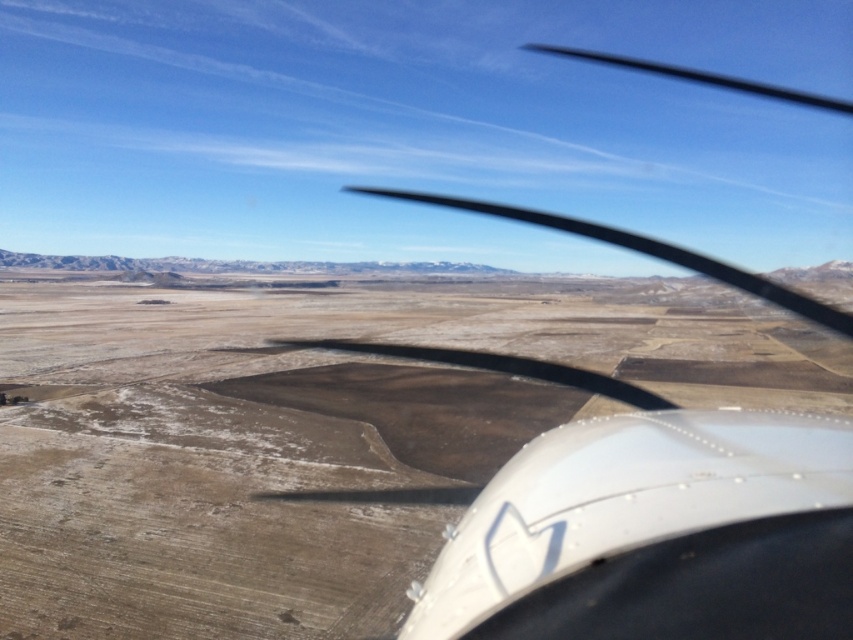
You are a passenger sitting in the aircraft and looking out the window. You notice two points marked on the window. The first is at point coordinates point (x=341, y=605) and the second is at point (x=650, y=616). Which of these two points is closer to you?

Point (x=341, y=605) is further to the viewer than point (x=650, y=616), so the point closer to you is point (x=650, y=616).